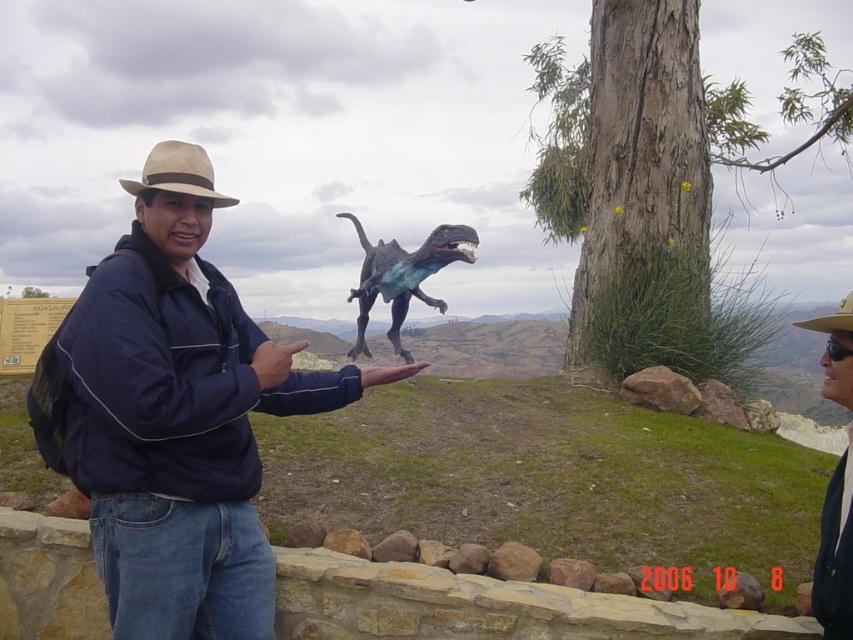
Can you confirm if matte blue hand at center is taller than brown straw cowboy hat at upper center?

In fact, matte blue hand at center may be shorter than brown straw cowboy hat at upper center.

Does matte blue hand at center lie in front of brown straw cowboy hat at upper center?

No, matte blue hand at center is further to the viewer.

Measure the distance between point (x=270, y=372) and camera.

The distance of point (x=270, y=372) from camera is 2.58 meters.

Locate an element on the screen. matte blue hand at center is located at coordinates (273, 362).

Who is positioned more to the right, shiny metallic dinosaur at center or matte skin hand at center?

matte skin hand at center is more to the right.

Looking at this image, does shiny metallic dinosaur at center lie in front of matte skin hand at center?

No, shiny metallic dinosaur at center is behind matte skin hand at center.

Is point (364, 324) more distant than point (387, 371)?

Yes, point (364, 324) is behind point (387, 371).

Locate an element on the screen. This screenshot has height=640, width=853. shiny metallic dinosaur at center is located at coordinates (403, 276).

Who is taller, shiny metallic dinosaur at center or brown straw cowboy hat at upper center?

shiny metallic dinosaur at center

Where is `shiny metallic dinosaur at center`? The image size is (853, 640). shiny metallic dinosaur at center is located at coordinates (403, 276).